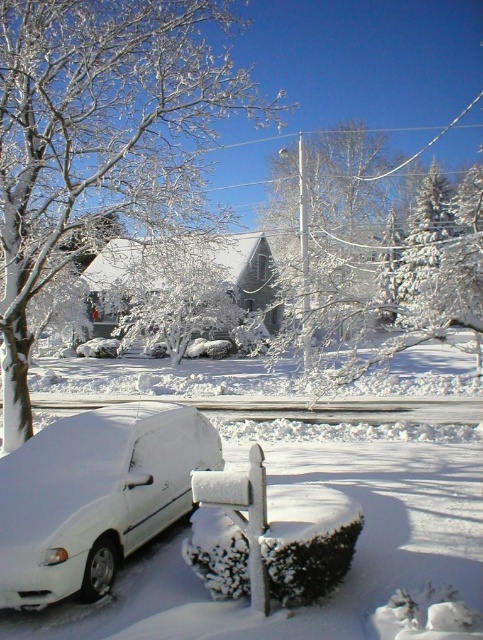
Question: Considering the real-world distances, which object is closest to the snow-covered evergreen at upper right?

Choices:
 (A) white fluffy snow at lower left
 (B) white matte car at lower left

Answer: (B)

Question: Estimate the real-world distances between objects in this image. Which object is farther from the snow-covered evergreen at upper right?

Choices:
 (A) white frosty tree at upper left
 (B) white fluffy snow at lower left
 (C) white matte car at lower left

Answer: (A)

Question: Where is white matte car at lower left located in relation to snow-covered evergreen at upper right in the image?

Choices:
 (A) above
 (B) below

Answer: (B)

Question: Among these objects, which one is farthest from the camera?

Choices:
 (A) white fluffy snow at lower left
 (B) snow-covered evergreen at upper right
 (C) white frosty tree at upper left
 (D) white matte car at lower left

Answer: (C)

Question: Where is white fluffy snow at lower left located in relation to snow-covered evergreen at upper right in the image?

Choices:
 (A) below
 (B) above

Answer: (A)

Question: Can you confirm if white fluffy snow at lower left is bigger than snow-covered evergreen at upper right?

Choices:
 (A) yes
 (B) no

Answer: (B)